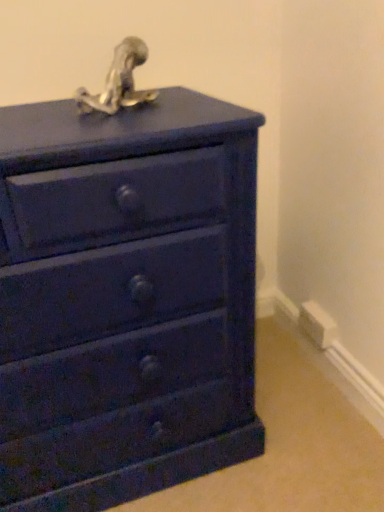
Identify the location of unoccupied region to the right of metallic silver sculpture at top. (193, 108).